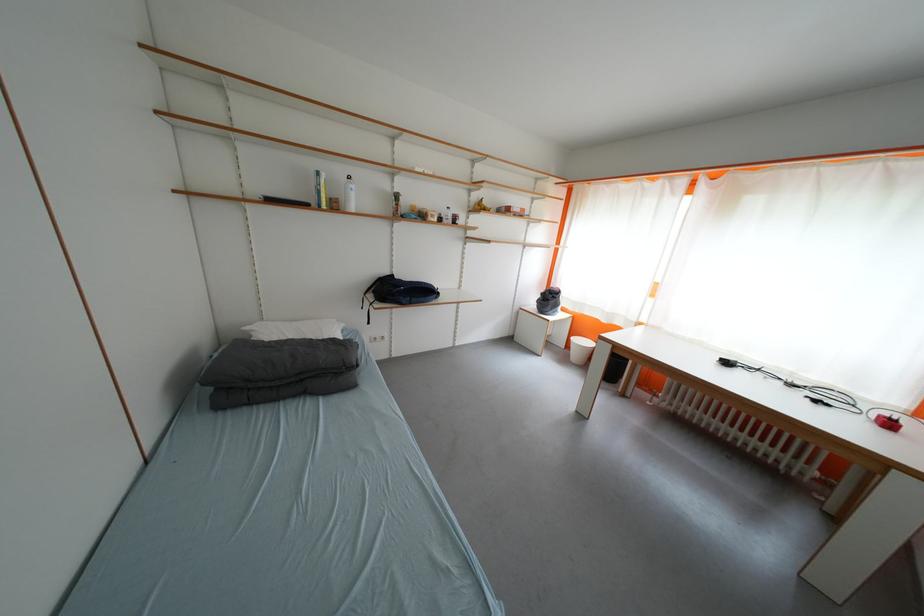
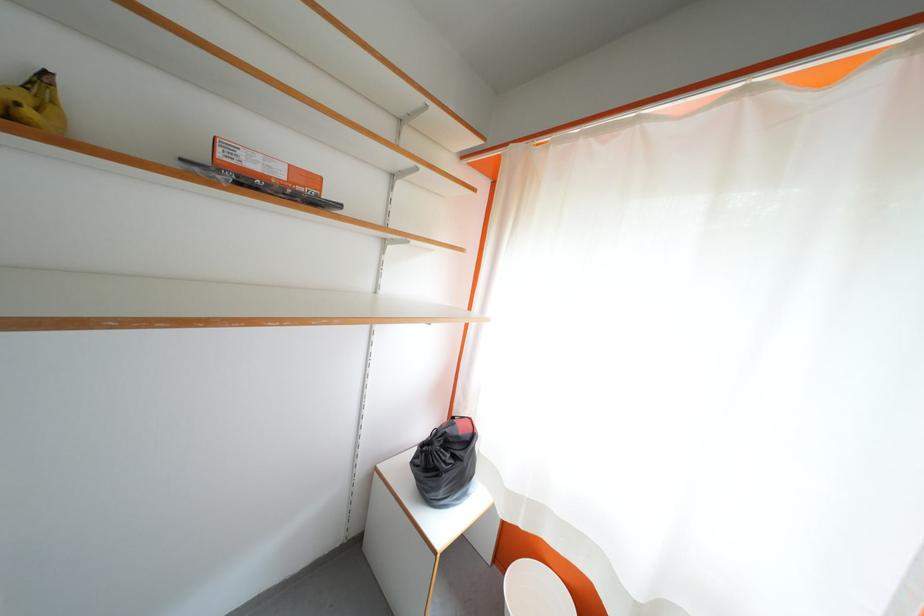
The point at (558,302) is marked in the first image. Where is the corresponding point in the second image?

(455, 460)